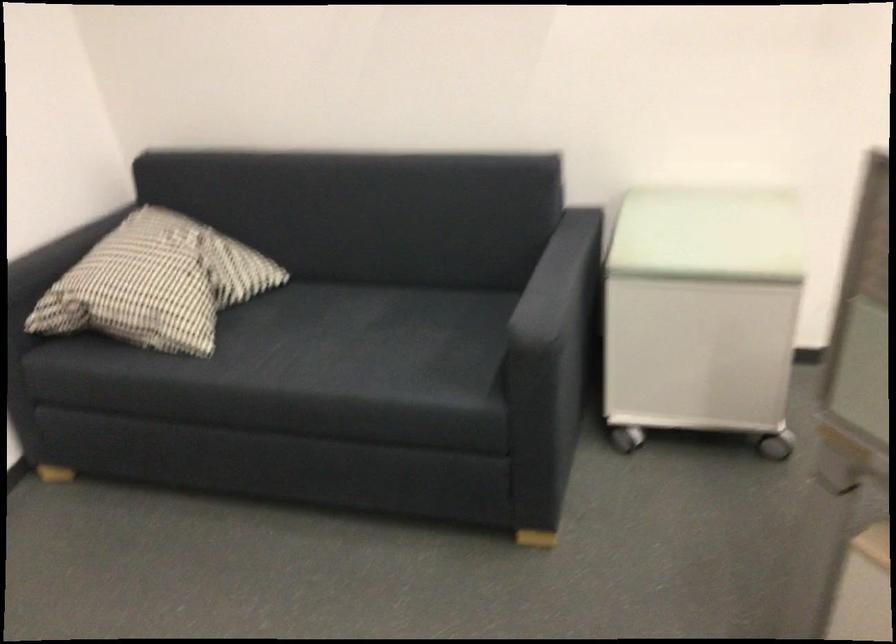
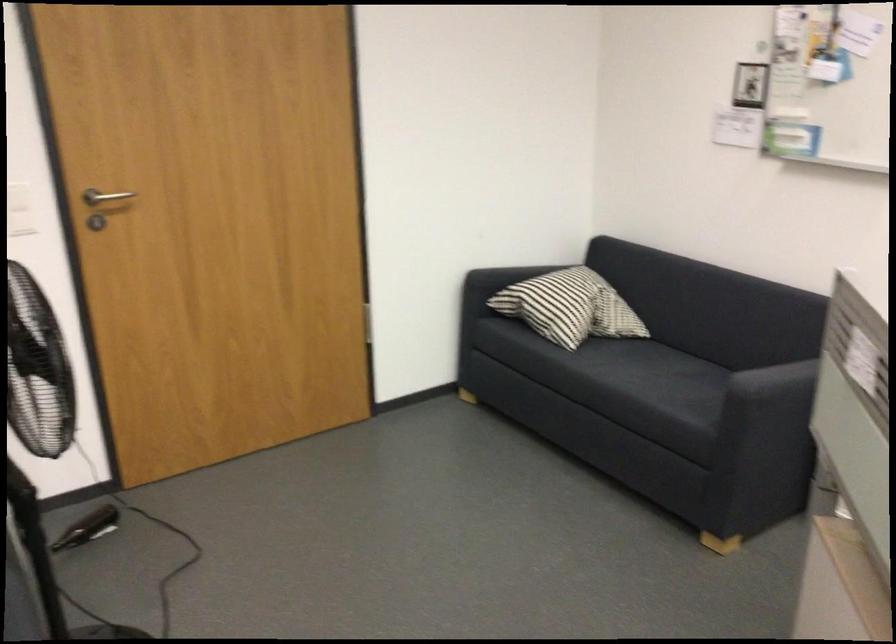
In the second image, find the point that corresponds to (177,292) in the first image.

(570, 307)